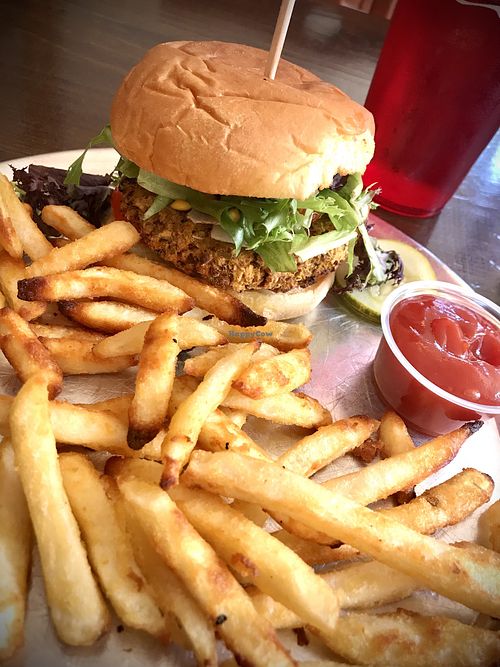
Where is `white rim of plate`? This screenshot has width=500, height=667. white rim of plate is located at coordinates click(100, 153).